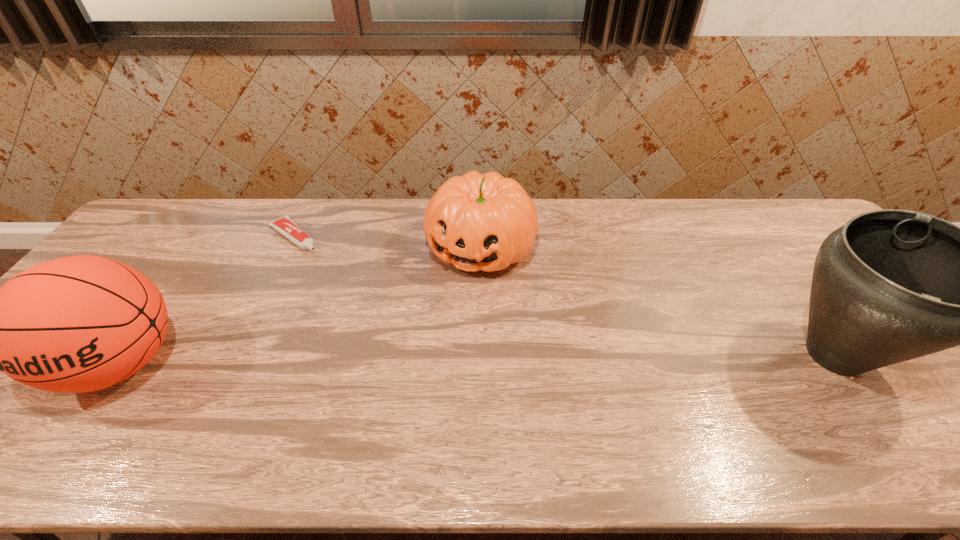
At what (x,y) coordinates should I click in order to perform the action: click on blank region between the urn and the pumpkin. Please return your answer as a coordinate pair (x, y). Looking at the image, I should click on (658, 301).

You are a GUI agent. You are given a task and a screenshot of the screen. Output one action in this format:
    pyautogui.click(x=<x>, y=<y>)
    Task: Click on the unoccupied area between the toothpaste and the basketball
    The width and height of the screenshot is (960, 540).
    Given the screenshot: What is the action you would take?
    pyautogui.click(x=208, y=300)

I want to click on unoccupied position between the leftmost object and the third object from right to left, so click(x=208, y=300).

The height and width of the screenshot is (540, 960). What are the coordinates of `object that is the second closest one to the basketball` in the screenshot? It's located at (486, 222).

This screenshot has height=540, width=960. Find the location of `object that is the third closest to the second object from right to left`. object that is the third closest to the second object from right to left is located at coordinates (76, 324).